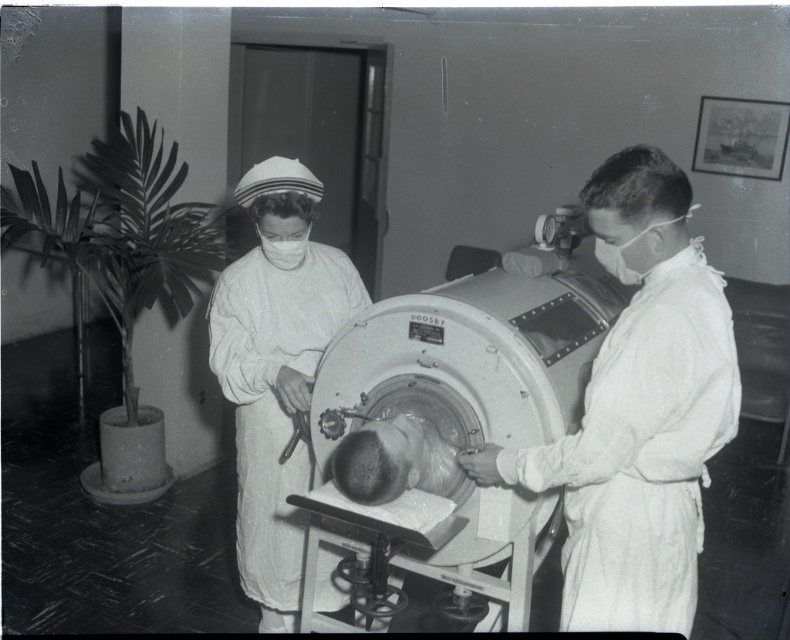
Question: Is smooth white coat at center closer to camera compared to matte white mask at center?

Choices:
 (A) yes
 (B) no

Answer: (A)

Question: Which of the following is the farthest from the observer?

Choices:
 (A) smooth white coat at center
 (B) matte white mask at center
 (C) white cloth nurse at center
 (D) metallic cylindrical tank at center

Answer: (B)

Question: Is smooth white coat at center positioned in front of white cloth nurse at center?

Choices:
 (A) no
 (B) yes

Answer: (B)

Question: Which point is closer to the camera?

Choices:
 (A) metallic cylindrical tank at center
 (B) matte white mask at center
 (C) smooth white coat at center

Answer: (C)

Question: Which of the following is the farthest from the observer?

Choices:
 (A) white cloth nurse at center
 (B) metallic cylindrical tank at center

Answer: (A)

Question: From the image, what is the correct spatial relationship of smooth white coat at center in relation to white cloth nurse at center?

Choices:
 (A) below
 (B) above

Answer: (B)